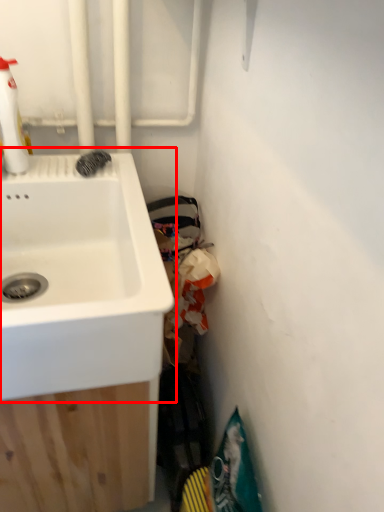
Question: From the image's perspective, what is the correct spatial positioning of sink (annotated by the red box) in reference to cleaning product?

Choices:
 (A) below
 (B) above

Answer: (A)